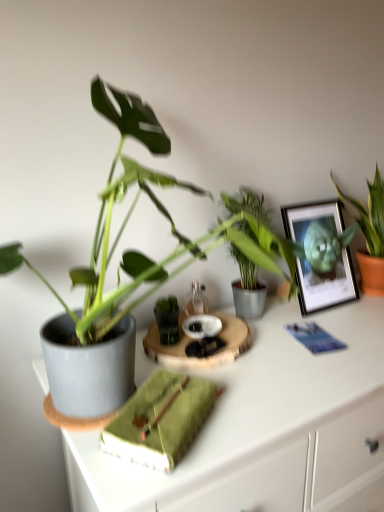
Question: From the image's perspective, is green fabric book at center above or below metallic silver picture frame at upper right?

Choices:
 (A) above
 (B) below

Answer: (B)

Question: Considering the positions of green fabric book at center and metallic silver picture frame at upper right in the image, is green fabric book at center taller or shorter than metallic silver picture frame at upper right?

Choices:
 (A) short
 (B) tall

Answer: (A)

Question: Considering the real-world distances, which object is farthest from the green leafy plant at upper right, marked as the second houseplant in a left-to-right arrangement?

Choices:
 (A) matte gray pot at left
 (B) green fabric book at center
 (C) metallic silver picture frame at upper right
 (D) matte gray pot at center-left, which appears as the 1th houseplant when viewed from the left

Answer: (B)

Question: Which is farther from the matte gray pot at center-left, which appears as the 1th houseplant when viewed from the left?

Choices:
 (A) metallic silver picture frame at upper right
 (B) green fabric book at center
 (C) green leafy plant at upper right, marked as the second houseplant in a left-to-right arrangement
 (D) matte gray pot at left

Answer: (C)